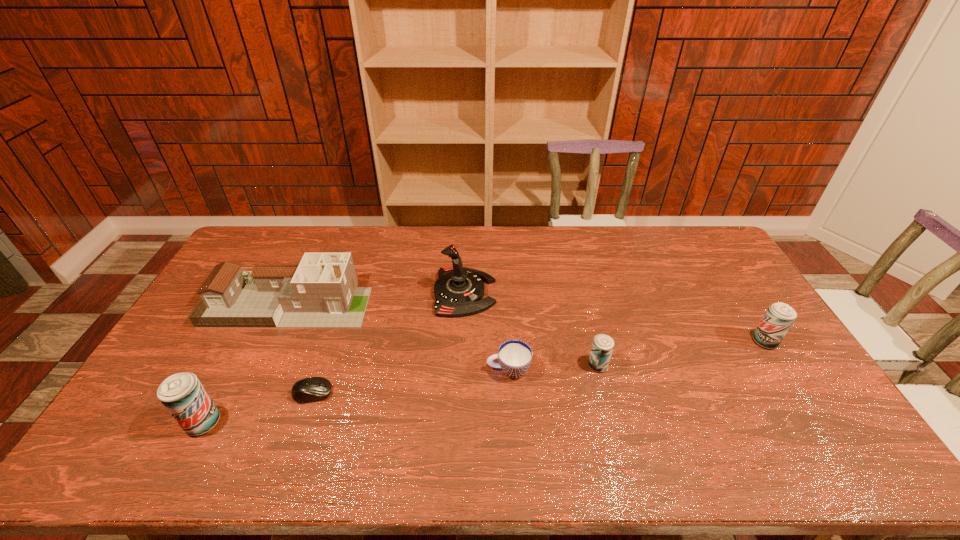
This screenshot has width=960, height=540. What are the coordinates of `free region located 0.120m on the right of the nearest beer can` in the screenshot? It's located at (267, 423).

Identify the location of blank area located 0.330m on the left of the fifth tallest object. Image resolution: width=960 pixels, height=540 pixels. (473, 366).

The height and width of the screenshot is (540, 960). Identify the location of vacant space situated on the left of the second tallest beer can. (624, 341).

The width and height of the screenshot is (960, 540). I want to click on free location located at the main entrance of the dollhouse, so click(x=437, y=304).

Locate an element on the screen. The width and height of the screenshot is (960, 540). blank area located 0.390m on the handle side of the joystick is located at coordinates (611, 293).

Find the location of a particular element. free region located 0.190m on the side of the cup with the handle is located at coordinates (420, 370).

This screenshot has height=540, width=960. What are the coordinates of `free spot located 0.390m on the side of the cup with the handle` in the screenshot? It's located at (349, 370).

Locate an element on the screen. The height and width of the screenshot is (540, 960). vacant area located 0.210m on the side of the cup with the handle is located at coordinates (413, 370).

Image resolution: width=960 pixels, height=540 pixels. I want to click on free space located 0.060m on the back of the mouse, so click(323, 366).

You are a GUI agent. You are given a task and a screenshot of the screen. Output one action in this format:
    pyautogui.click(x=<x>, y=<y>)
    Task: Click on the beer can situated at the near edge
    
    Given the screenshot: What is the action you would take?
    (182, 394)